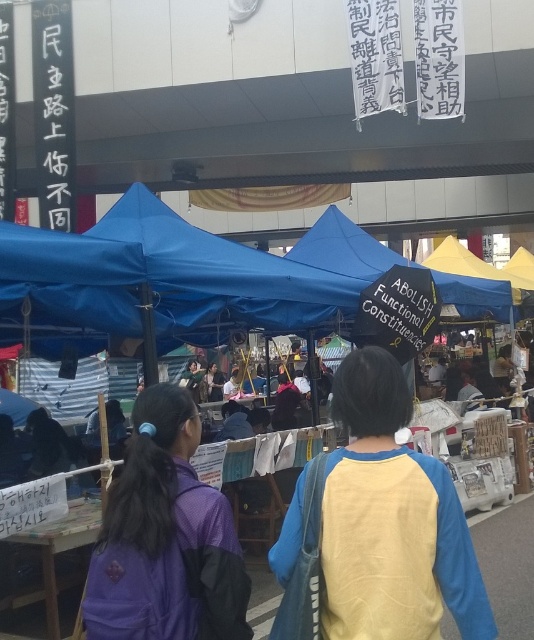
Measure the distance between point (331, 637) and camera.

Point (331, 637) is 1.99 meters from camera.

Does yellow fabric shirt at center have a greater height compared to purple fabric jacket at center?

Yes, yellow fabric shirt at center is taller than purple fabric jacket at center.

Is point (482, 579) less distant than point (161, 563)?

No.

What are the coordinates of `yellow fabric shirt at center` in the screenshot? It's located at (375, 528).